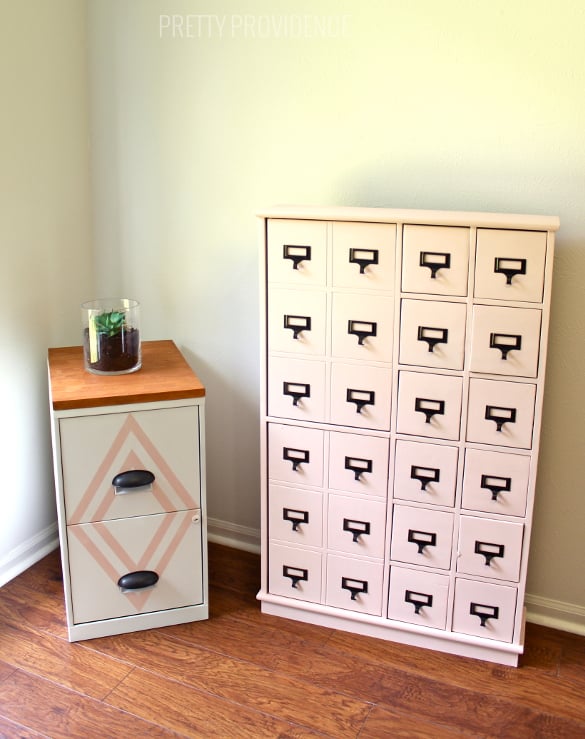
Where is `surface on top of cabinet`? This screenshot has height=739, width=585. surface on top of cabinet is located at coordinates (154, 378), (375, 213).